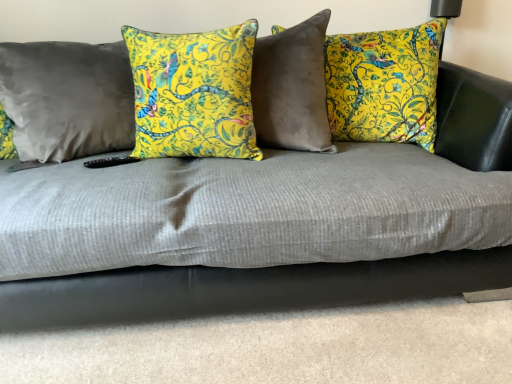
Question: Considering the positions of point (271, 31) and point (155, 140), is point (271, 31) closer or farther from the camera than point (155, 140)?

Choices:
 (A) farther
 (B) closer

Answer: (A)

Question: Considering the positions of yellow floral pillow at center, which is the third pillow in left-to-right order, and yellow floral pillow at center, the second pillow positioned from the left, in the image, is yellow floral pillow at center, which is the third pillow in left-to-right order, bigger or smaller than yellow floral pillow at center, the second pillow positioned from the left,?

Choices:
 (A) small
 (B) big

Answer: (B)

Question: Based on their relative distances, which object is farther from the yellow floral pillow at center, the second pillow positioned from the left?

Choices:
 (A) satin gray pillow at left, placed as the 1th pillow when sorted from left to right
 (B) yellow floral pillow at center, the first pillow in the right-to-left sequence

Answer: (B)

Question: Which object is positioned closest to the yellow floral pillow at center, the second pillow viewed from the right?

Choices:
 (A) satin gray pillow at left, the third pillow in the right-to-left sequence
 (B) yellow floral pillow at center, the first pillow in the right-to-left sequence

Answer: (A)